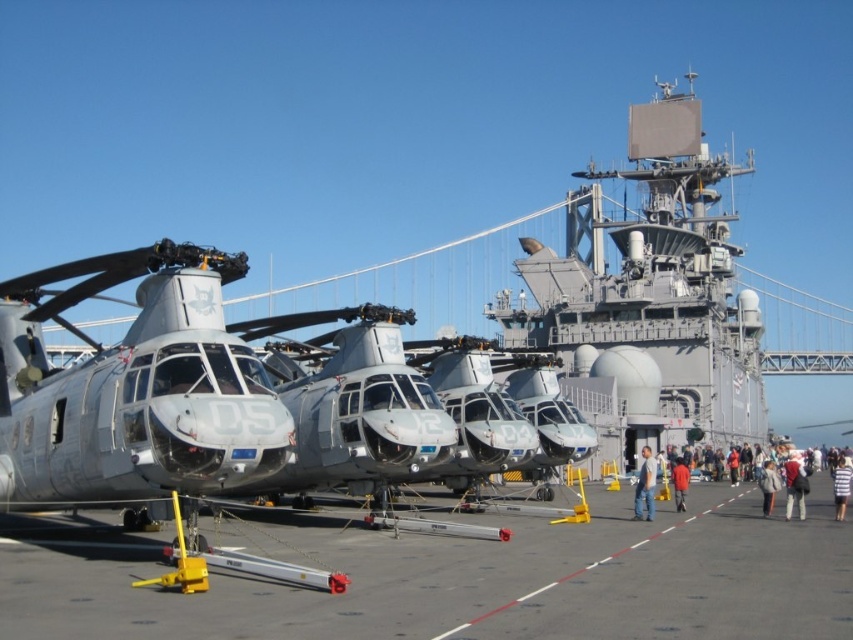
You are a pilot on the deck of an amphibious assault ship. You need to locate the matte gray helicopter at left. Where should you look relative to the ship?

The matte gray helicopter at left is located at point (x=135, y=387) on the ship deck.

You are a drone operator controlling a drone that needs to hover above the ship deck. You see two points marked on the deck at coordinates point (637, 516) and point (761, 492). Which point is closer to your current position above the deck?

Point (637, 516) is closer to the camera than point (761, 492), so the drone should hover above point (637, 516) first since it is nearer to the current position.